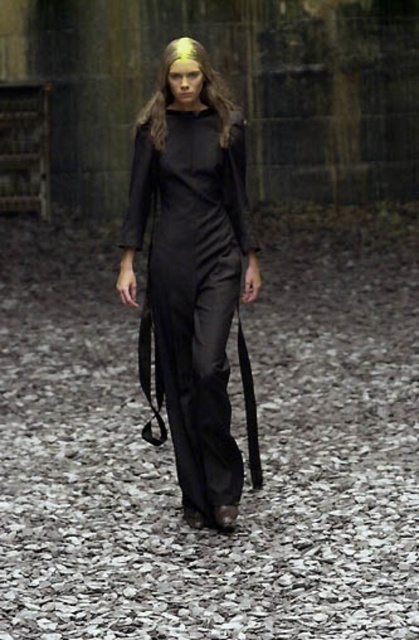
Between black fabric path at center and golden hair at center, which one appears on the right side from the viewer's perspective?

black fabric path at center is more to the right.

Does black fabric path at center appear under golden hair at center?

Correct, black fabric path at center is located below golden hair at center.

The width and height of the screenshot is (419, 640). What are the coordinates of `black fabric path at center` in the screenshot? It's located at (173, 460).

At what (x,y) coordinates should I click in order to perform the action: click on black fabric path at center. Please return your answer as a coordinate pair (x, y). This screenshot has height=640, width=419. Looking at the image, I should click on (173, 460).

Is black fabric path at center wider than satin black dress at center?

Correct, the width of black fabric path at center exceeds that of satin black dress at center.

Find the location of a particular element. This screenshot has width=419, height=640. black fabric path at center is located at coordinates (173, 460).

The width and height of the screenshot is (419, 640). What do you see at coordinates (173, 460) in the screenshot?
I see `black fabric path at center` at bounding box center [173, 460].

At what (x,y) coordinates should I click in order to perform the action: click on black fabric path at center. Please return your answer as a coordinate pair (x, y). Image resolution: width=419 pixels, height=640 pixels. Looking at the image, I should click on (173, 460).

Which of these two, satin black dress at center or golden hair at center, stands taller?

golden hair at center

Does satin black dress at center have a larger size compared to golden hair at center?

Actually, satin black dress at center might be smaller than golden hair at center.

Does point (183, 280) lie behind point (219, 99)?

No, (183, 280) is closer to viewer.

You are a GUI agent. You are given a task and a screenshot of the screen. Output one action in this format:
    pyautogui.click(x=<x>, y=<y>)
    Task: Click on the satin black dress at center
    
    Given the screenshot: What is the action you would take?
    pyautogui.click(x=191, y=269)